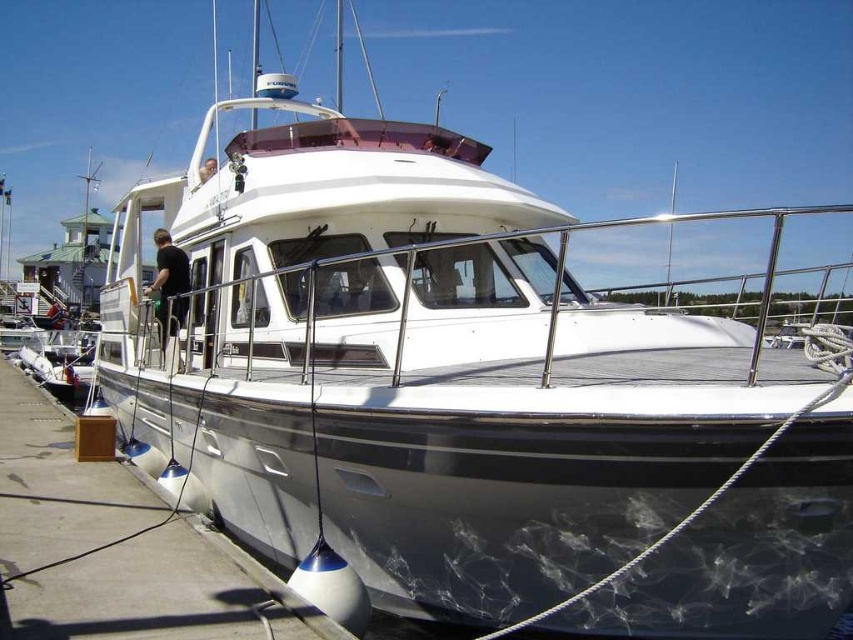
Question: Estimate the real-world distances between objects in this image. Which object is closer to the light brown wooden boat at center?

Choices:
 (A) black matte shirt at center
 (B) white glossy dock at lower center

Answer: (A)

Question: Is black matte shirt at center smaller than light brown wooden boat at center?

Choices:
 (A) yes
 (B) no

Answer: (B)

Question: Is white glossy dock at lower center in front of black matte shirt at center?

Choices:
 (A) yes
 (B) no

Answer: (A)

Question: From the image, what is the correct spatial relationship of black matte shirt at center in relation to light brown wooden boat at center?

Choices:
 (A) right
 (B) left

Answer: (B)

Question: Which object appears closest to the camera in this image?

Choices:
 (A) light brown wooden boat at center
 (B) white glossy dock at lower center

Answer: (B)

Question: Considering the real-world distances, which object is closest to the white glossy dock at lower center?

Choices:
 (A) black matte shirt at center
 (B) light brown wooden boat at center

Answer: (A)